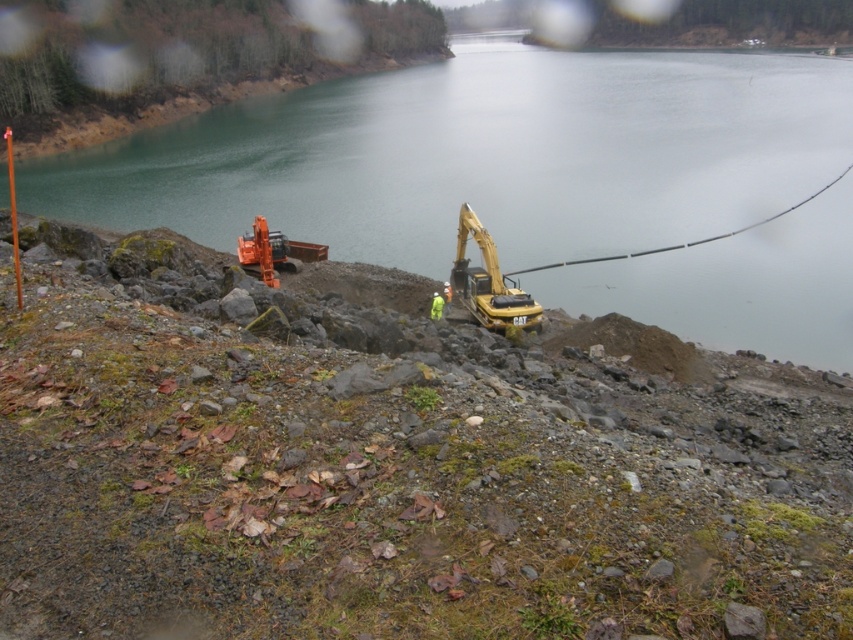
Question: Which of these objects is positioned farthest from the greenish water at upper center?

Choices:
 (A) orange metallic excavator at center
 (B) yellow reflective vest at center

Answer: (A)

Question: Can you confirm if greenish water at upper center is positioned below yellow metallic excavator at center?

Choices:
 (A) yes
 (B) no

Answer: (B)

Question: Is greenish water at upper center closer to camera compared to orange metallic excavator at center?

Choices:
 (A) yes
 (B) no

Answer: (A)

Question: Which point is farther from the camera taking this photo?

Choices:
 (A) (274, 275)
 (B) (263, 132)
 (C) (457, 252)

Answer: (B)

Question: Is greenish water at upper center above yellow metallic excavator at center?

Choices:
 (A) yes
 (B) no

Answer: (A)

Question: Estimate the real-world distances between objects in this image. Which object is farther from the orange metallic excavator at center?

Choices:
 (A) yellow reflective vest at center
 (B) yellow metallic excavator at center
 (C) greenish water at upper center

Answer: (C)